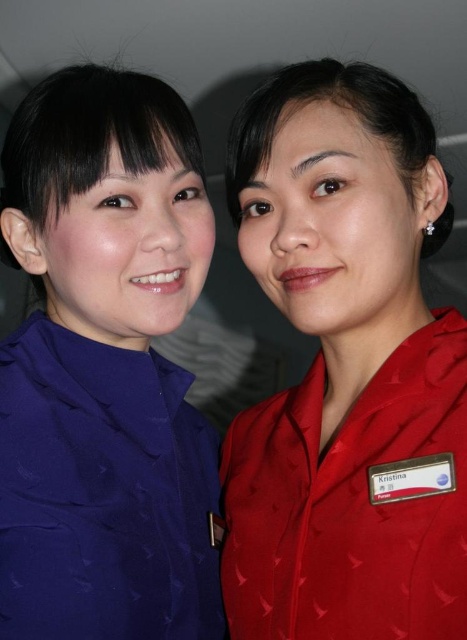
Question: Can you confirm if matte red uniform at right is positioned to the right of matte blue shirt at left?

Choices:
 (A) yes
 (B) no

Answer: (A)

Question: Is matte red uniform at right wider than matte blue shirt at left?

Choices:
 (A) no
 (B) yes

Answer: (B)

Question: Is matte red uniform at right to the right of matte blue shirt at left from the viewer's perspective?

Choices:
 (A) yes
 (B) no

Answer: (A)

Question: Which of the following is the closest to the observer?

Choices:
 (A) matte red uniform at right
 (B) matte blue shirt at left

Answer: (A)